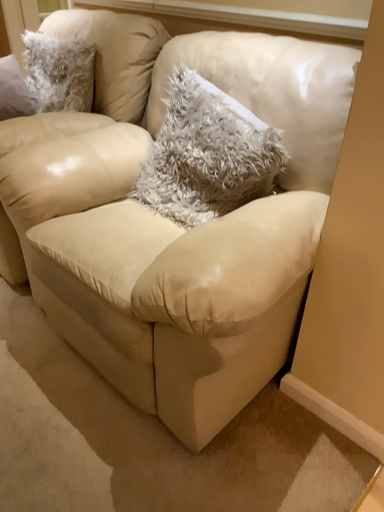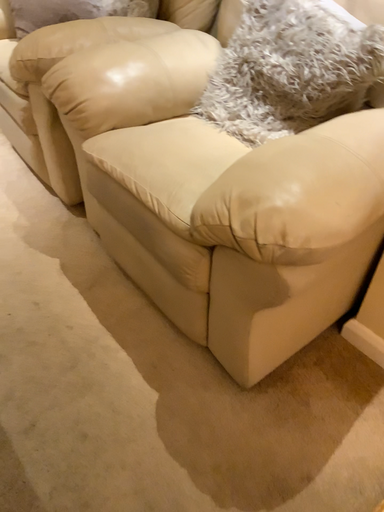
Question: How did the camera likely rotate when shooting the video?

Choices:
 (A) rotated right
 (B) rotated left

Answer: (B)